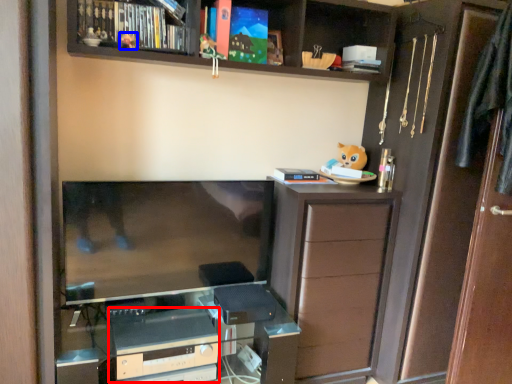
Question: Among these objects, which one is nearest to the camera, appliance (highlighted by a red box) or toy (highlighted by a blue box)?

Choices:
 (A) appliance
 (B) toy

Answer: (B)